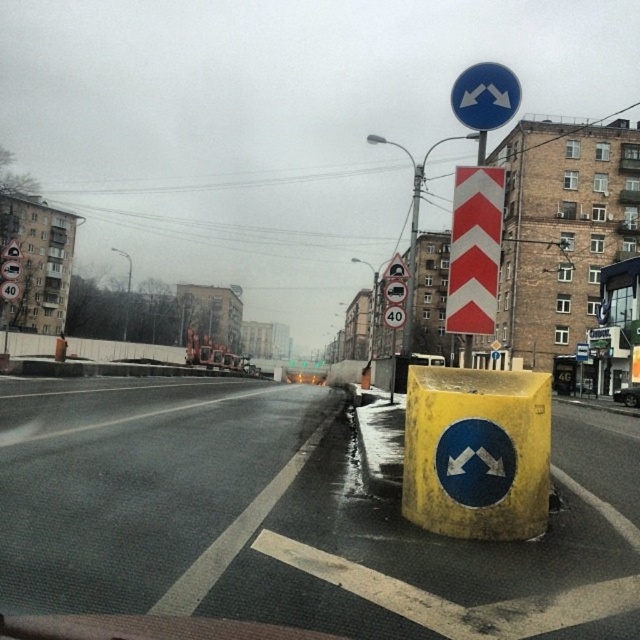
Which is behind, point (456, 198) or point (400, 317)?

Point (400, 317)

Does white reflective chevron at center appear under white plastic speed limit sign at center?

No.

You are a GUI agent. You are given a task and a screenshot of the screen. Output one action in this format:
    pyautogui.click(x=<x>, y=<y>)
    Task: Click on the white reflective chevron at center
    This screenshot has height=640, width=640.
    Given the screenshot: What is the action you would take?
    pyautogui.click(x=474, y=250)

Which is above, blue glossy traffic sign at upper center or metallic rectangular sign at center?

blue glossy traffic sign at upper center is higher up.

Does blue glossy traffic sign at upper center come in front of metallic rectangular sign at center?

That is True.

This screenshot has height=640, width=640. What do you see at coordinates (484, 97) in the screenshot? I see `blue glossy traffic sign at upper center` at bounding box center [484, 97].

Find the location of a particular element. The height and width of the screenshot is (640, 640). blue glossy traffic sign at upper center is located at coordinates (484, 97).

Is point (385, 296) farther from camera compared to point (401, 314)?

No, it is not.

The height and width of the screenshot is (640, 640). What do you see at coordinates (394, 291) in the screenshot? I see `metallic rectangular sign at center` at bounding box center [394, 291].

Between point (384, 294) and point (397, 317), which one is positioned behind?

Point (384, 294)

The height and width of the screenshot is (640, 640). I want to click on metallic rectangular sign at center, so click(x=394, y=291).